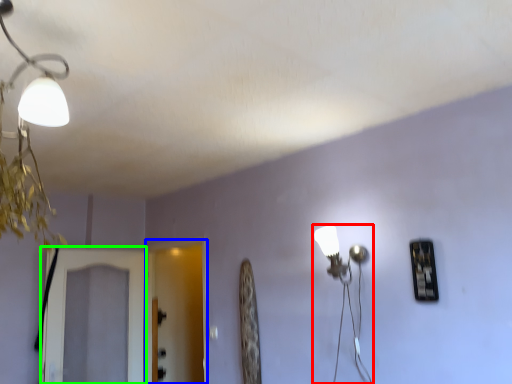
Question: Which is nearer to the lamp (highlighted by a red box)? screen door (highlighted by a blue box) or screen door (highlighted by a green box).

Choices:
 (A) screen door
 (B) screen door

Answer: (B)